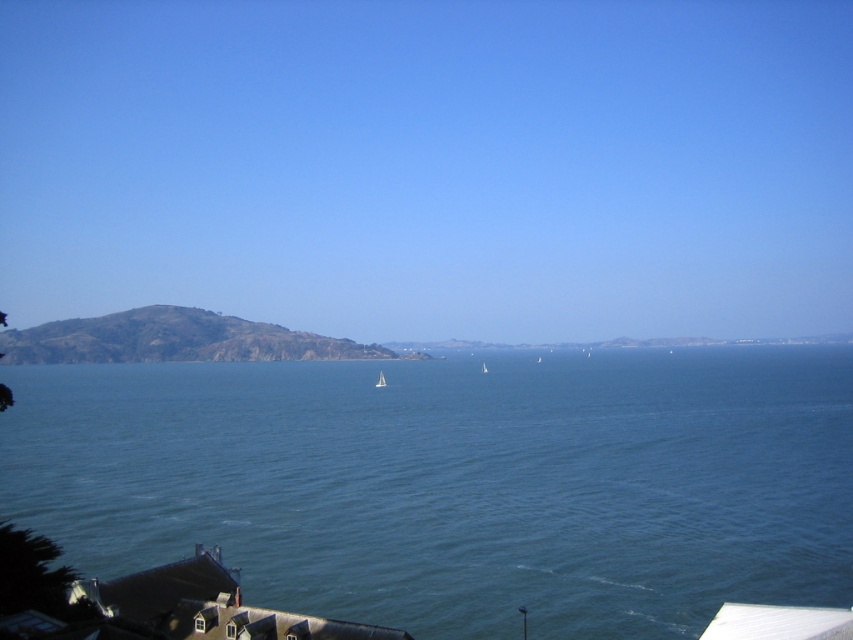
Looking at this image, you are standing at the coastal area shown in the image. There is a specific point marked at coordinates point (476, 438). Can you determine if this point is within a safe distance for a beginner swimmer to reach without assistance?

The point (476, 438) is 167.06 meters away from the viewer. Since beginner swimmers typically should not swim beyond 50 meters without assistance, this distance is too far for safe unassisted swimming.

You are standing on the rooftop of one of the houses in the scene and want to observe the blue water at center and the white matte sailboat at center. Which object is closer to you?

The white matte sailboat at center is closer to you because the blue water at center is 126.32 meters away from it, implying the sailboat is nearer to the observer on the rooftop.

Based on the photo, you are standing on the rooftop and looking out at the blue water at center and the white glossy sailboat at center. Which object appears taller from your vantage point?

The blue water at center appears taller than the white glossy sailboat at center from your vantage point.